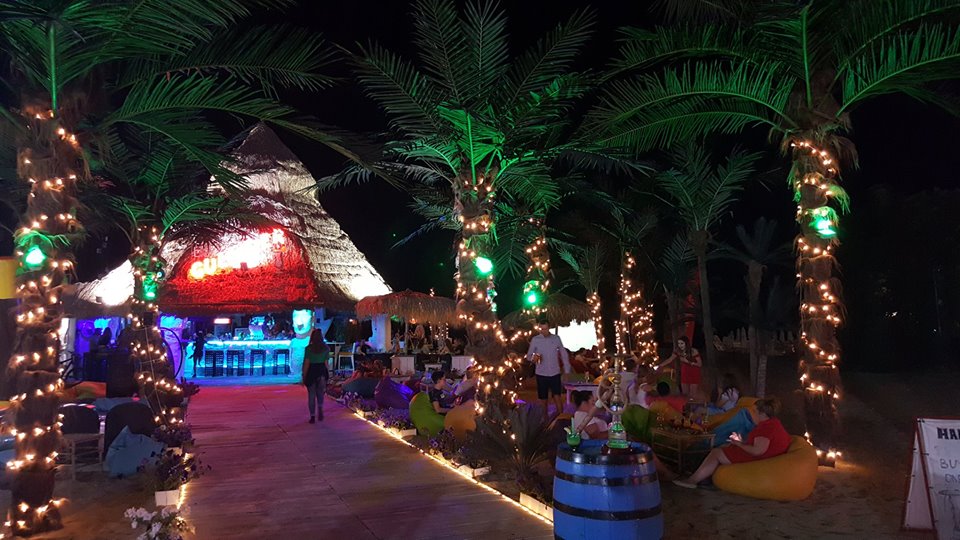
The height and width of the screenshot is (540, 960). In order to click on tiki bar in this screenshot , I will do `click(252, 338)`.